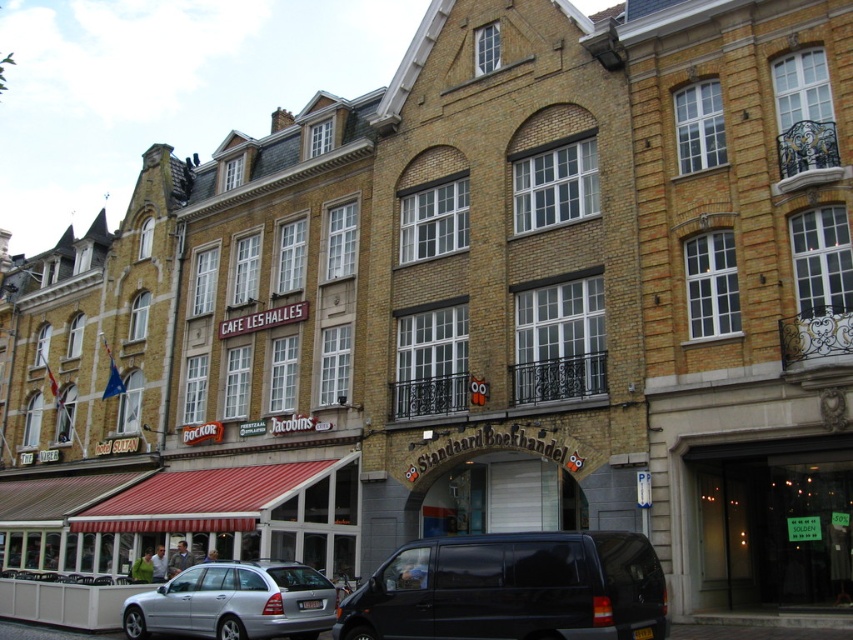
Can you confirm if black matte van at center is smaller than silver metallic car at center?

Incorrect, black matte van at center is not smaller in size than silver metallic car at center.

Can you confirm if black matte van at center is positioned to the right of silver metallic car at center?

Yes, black matte van at center is to the right of silver metallic car at center.

Is point (648, 609) farther from viewer compared to point (222, 573)?

No, (648, 609) is in front of (222, 573).

The image size is (853, 640). In order to click on black matte van at center in this screenshot , I will do `click(512, 589)`.